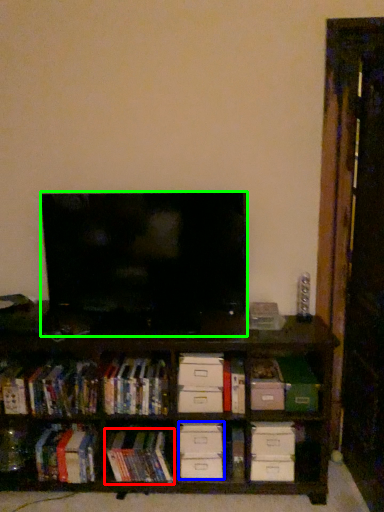
Question: Estimate the real-world distances between objects in this image. Which object is farther from book (highlighted by a red box), drawer (highlighted by a blue box) or television (highlighted by a green box)?

Choices:
 (A) drawer
 (B) television

Answer: (B)